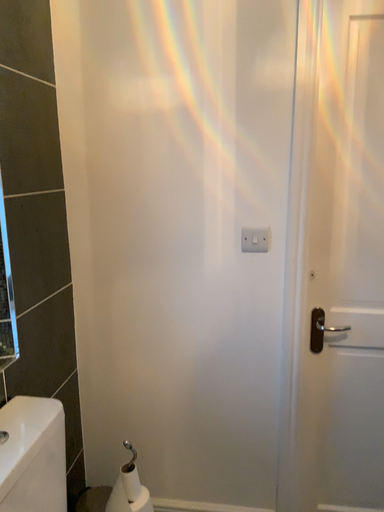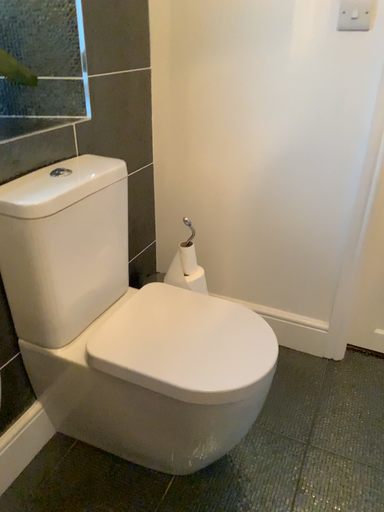
Question: Which way did the camera rotate in the video?

Choices:
 (A) rotated downward
 (B) rotated upward

Answer: (A)